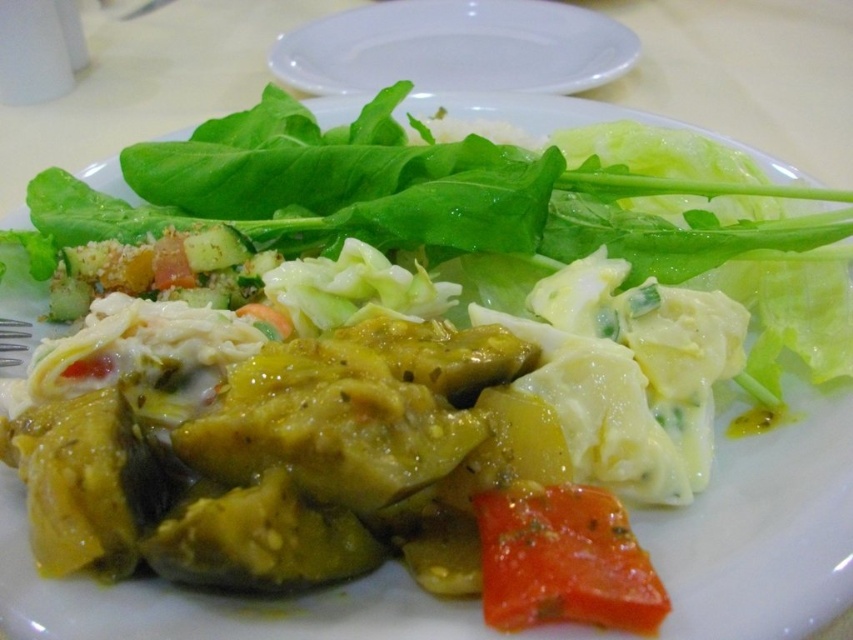
You are a food critic analyzing the arrangement of the meal. Which object is placed above the other between the white plastic plate at upper center and the glossy red tomato at lower center?

The white plastic plate at upper center is positioned over the glossy red tomato at lower center, meaning it is placed above the tomato.

You are a food critic sitting at a table with the white plastic plate at upper center and the glossy red tomato at lower center in front of you. Which object is closer to your face?

The white plastic plate at upper center is closer to your face because it is positioned further to the viewer than the glossy red tomato at lower center.

Based on the photo, you are a food delivery robot with a 1.2 meter arm reach. You need to pick up the white plastic plate at upper center and place it on the glossy red tomato at lower center. Can your arm reach from the plate to the tomato?

The distance between the white plastic plate at upper center and the glossy red tomato at lower center is 1.31 meters, which exceeds the robot arm reach of 1.2 meters. Therefore, the robot cannot reach the tomato from the plate.